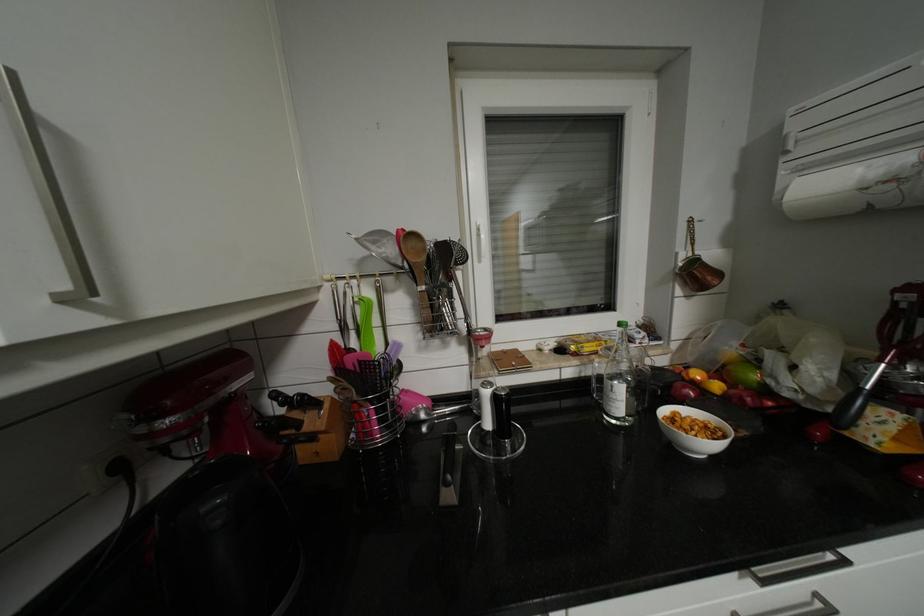
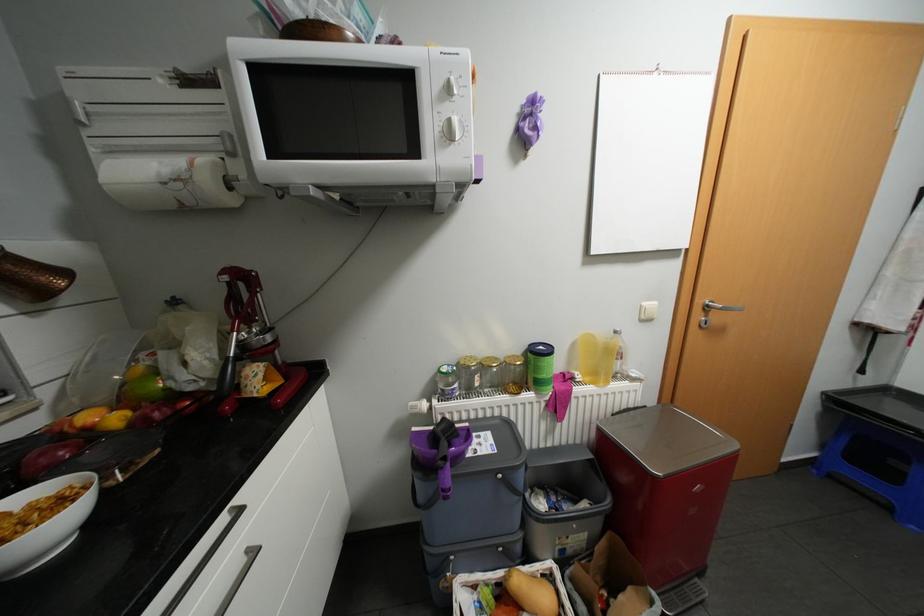
Question: The camera is either moving clockwise (left) or counter-clockwise (right) around the object. The first image is from the beginning of the video and the second image is from the end. Is the camera moving left or right when shooting the video?

Choices:
 (A) Left
 (B) Right

Answer: (A)